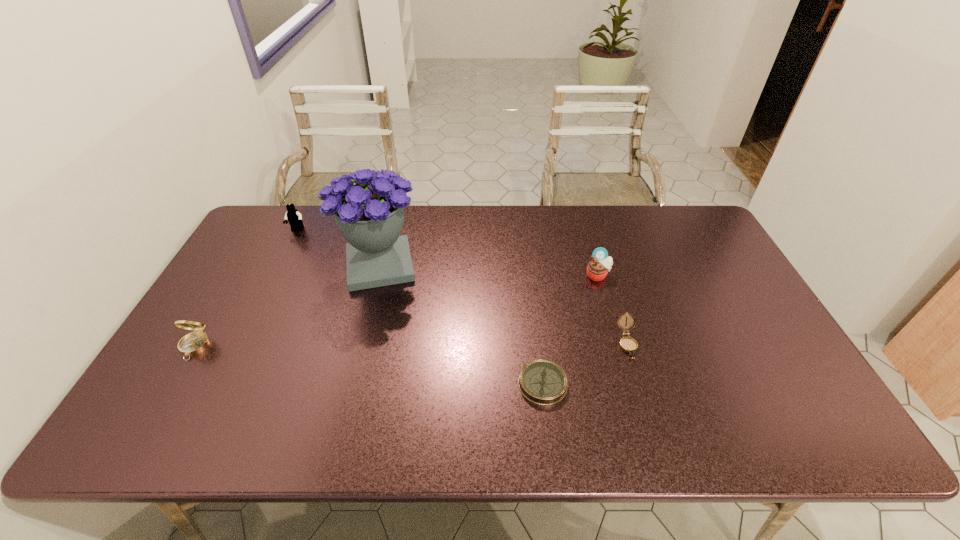
Locate an element on the screen. the tallest object is located at coordinates (370, 213).

Where is `the fourth object from right to left`? The image size is (960, 540). the fourth object from right to left is located at coordinates (370, 213).

You are a GUI agent. You are given a task and a screenshot of the screen. Output one action in this format:
    pyautogui.click(x=<x>, y=<y>)
    Task: Click on the Lego
    The height and width of the screenshot is (540, 960).
    Given the screenshot: What is the action you would take?
    pyautogui.click(x=294, y=218)

Where is `the second object from left to right`? This screenshot has height=540, width=960. the second object from left to right is located at coordinates (294, 218).

Image resolution: width=960 pixels, height=540 pixels. I want to click on muffin, so click(x=598, y=268).

You are a GUI agent. You are given a task and a screenshot of the screen. Output one action in this format:
    pyautogui.click(x=<x>, y=<y>)
    Task: Click on the leftmost object
    The height and width of the screenshot is (540, 960).
    Given the screenshot: What is the action you would take?
    pyautogui.click(x=194, y=343)

This screenshot has height=540, width=960. What are the coordinates of `the tallest compass` in the screenshot? It's located at (194, 343).

Where is `the second shortest compass`? The height and width of the screenshot is (540, 960). the second shortest compass is located at coordinates pos(629,345).

Find the location of a particular element. This screenshot has width=960, height=540. the second shortest object is located at coordinates (629, 345).

Find the location of a particular element. This screenshot has height=540, width=960. the shortest compass is located at coordinates (543, 382).